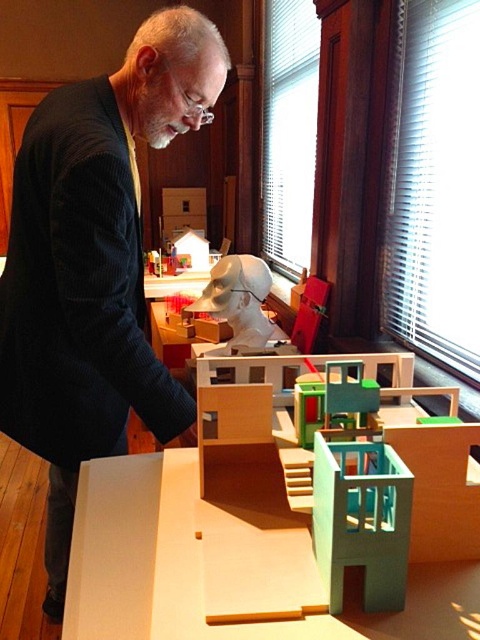
This screenshot has width=480, height=640. Describe the element at coordinates (95, 266) in the screenshot. I see `dark corduroy jacket at left` at that location.

Is dark corduroy jacket at left further to the viewer compared to white matte sculpture at center?

No, it is not.

Which is behind, point (75, 90) or point (217, 264)?

Positioned behind is point (217, 264).

Locate an element on the screen. Image resolution: width=480 pixels, height=640 pixels. dark corduroy jacket at left is located at coordinates (95, 266).

Can you confirm if peach wood table at center is positioned to the right of white matte sculpture at center?

No, peach wood table at center is not to the right of white matte sculpture at center.

In the scene shown: Can you confirm if peach wood table at center is positioned above white matte sculpture at center?

No, peach wood table at center is not above white matte sculpture at center.

Does point (273, 556) come closer to viewer compared to point (256, 330)?

That is True.

The image size is (480, 640). What are the coordinates of `peach wood table at center` in the screenshot? It's located at (224, 541).

Who is more distant from viewer, [453,468] or [339,547]?

→ The point [453,468] is behind.

Based on the photo, is peach wood table at center smaller than light blue plastic building at lower right?

Actually, peach wood table at center might be larger than light blue plastic building at lower right.

Where is `peach wood table at center`? peach wood table at center is located at coordinates (224, 541).

Locate an element on the screen. Image resolution: width=480 pixels, height=640 pixels. peach wood table at center is located at coordinates (224, 541).